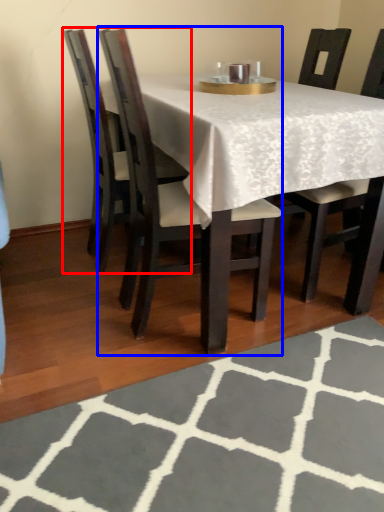
Question: Which object is closer to the camera taking this photo, chair (highlighted by a red box) or chair (highlighted by a blue box)?

Choices:
 (A) chair
 (B) chair

Answer: (B)